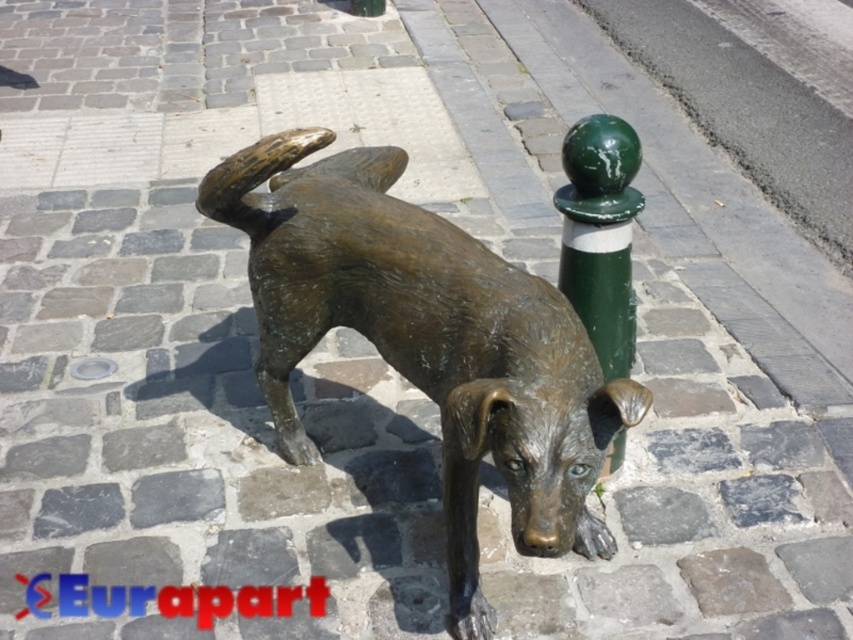
Who is positioned more to the right, bronze statue at center or green painted metal pole at upper right?

Positioned to the right is green painted metal pole at upper right.

Which is behind, point (607, 552) or point (633, 204)?

Positioned behind is point (607, 552).

At what (x,y) coordinates should I click in order to perform the action: click on bronze statue at center. Please return your answer as a coordinate pair (x, y). Looking at the image, I should click on (427, 340).